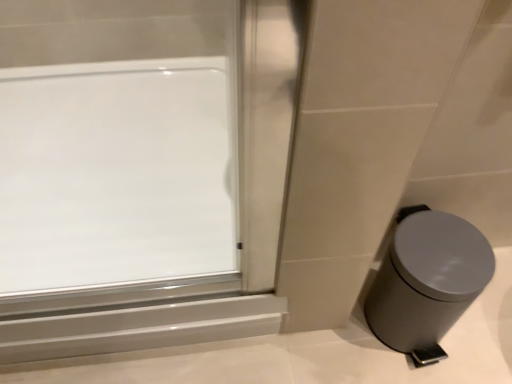
Question: Does transparent glass window at upper left have a greater height compared to gray matte waste container at lower right?

Choices:
 (A) yes
 (B) no

Answer: (B)

Question: Can you confirm if transparent glass window at upper left is positioned to the left of gray matte waste container at lower right?

Choices:
 (A) no
 (B) yes

Answer: (B)

Question: Does transparent glass window at upper left lie in front of gray matte waste container at lower right?

Choices:
 (A) no
 (B) yes

Answer: (A)

Question: Considering the relative sizes of transparent glass window at upper left and gray matte waste container at lower right in the image provided, is transparent glass window at upper left wider than gray matte waste container at lower right?

Choices:
 (A) no
 (B) yes

Answer: (B)

Question: Can you confirm if transparent glass window at upper left is smaller than gray matte waste container at lower right?

Choices:
 (A) yes
 (B) no

Answer: (B)

Question: Is transparent glass window at upper left at the right side of gray matte waste container at lower right?

Choices:
 (A) yes
 (B) no

Answer: (B)

Question: Is gray matte waste container at lower right aimed at transparent glass window at upper left?

Choices:
 (A) yes
 (B) no

Answer: (B)

Question: Is gray matte waste container at lower right positioned with its back to transparent glass window at upper left?

Choices:
 (A) no
 (B) yes

Answer: (A)

Question: Considering the relative sizes of gray matte waste container at lower right and transparent glass window at upper left in the image provided, is gray matte waste container at lower right bigger than transparent glass window at upper left?

Choices:
 (A) no
 (B) yes

Answer: (A)

Question: Is the position of gray matte waste container at lower right less distant than that of transparent glass window at upper left?

Choices:
 (A) yes
 (B) no

Answer: (A)

Question: Is gray matte waste container at lower right not close to transparent glass window at upper left?

Choices:
 (A) no
 (B) yes

Answer: (A)

Question: Is gray matte waste container at lower right surrounding transparent glass window at upper left?

Choices:
 (A) no
 (B) yes

Answer: (A)

Question: Looking at their shapes, would you say gray matte waste container at lower right is wider or thinner than transparent glass window at upper left?

Choices:
 (A) thin
 (B) wide

Answer: (A)